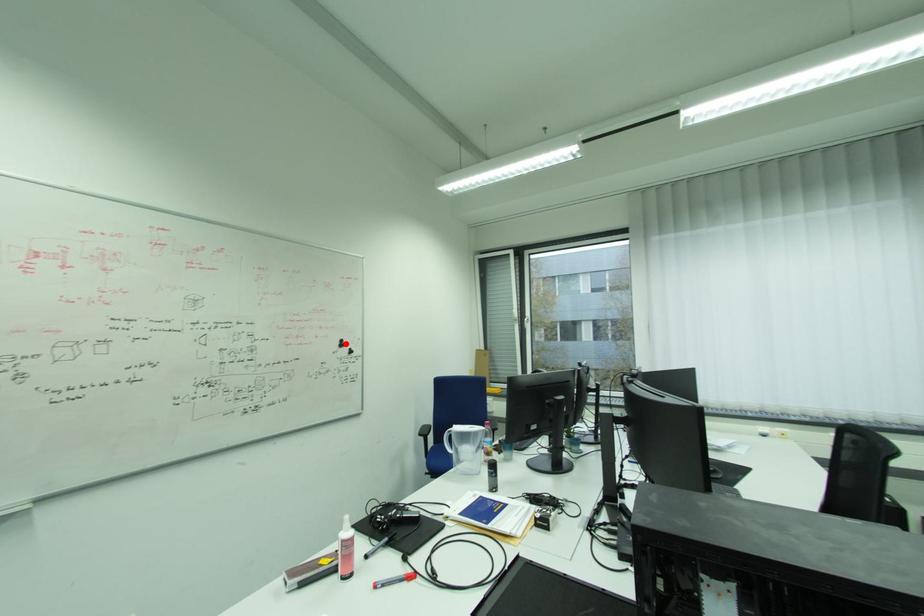
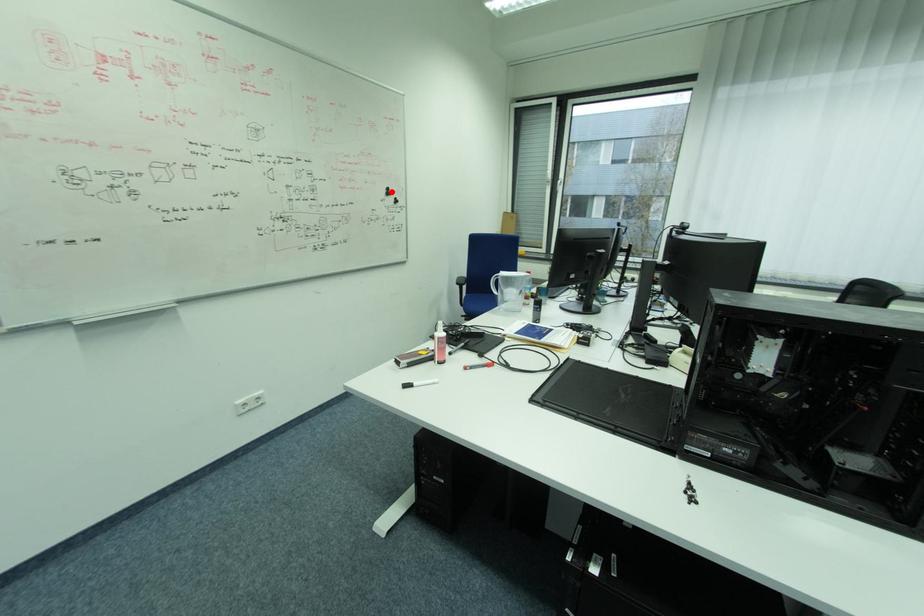
I am providing you with two images of the same scene from different viewpoints. A red point is marked on the first image and another point is marked on the second image. Do the highlighted points in image1 and image2 indicate the same real-world spot?

Yes